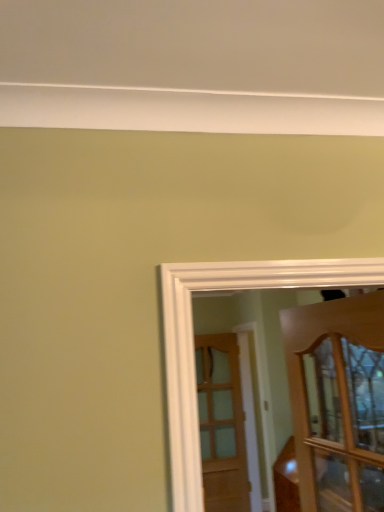
Question: Is point (203, 407) positioned closer to the camera than point (382, 308)?

Choices:
 (A) farther
 (B) closer

Answer: (A)

Question: Is wooden door at center, which appears as the second door when viewed from the top, wider or thinner than wooden cabinet at right, which appears as the 1th door when viewed from the top?

Choices:
 (A) thin
 (B) wide

Answer: (A)

Question: Considering their positions, is wooden door at center, which appears as the second door when viewed from the top, located in front of or behind wooden cabinet at right, which appears as the 1th door when viewed from the top?

Choices:
 (A) front
 (B) behind

Answer: (B)

Question: From a real-world perspective, relative to wooden door at center, which appears as the second door when viewed from the top, is wooden cabinet at right, the 2th door when ordered from bottom to top, vertically above or below?

Choices:
 (A) above
 (B) below

Answer: (A)

Question: Considering their positions, is wooden cabinet at right, placed as the 1th door when sorted from front to back, located in front of or behind wooden door at center, positioned as the 1th door in bottom-to-top order?

Choices:
 (A) behind
 (B) front

Answer: (B)

Question: In terms of height, does wooden cabinet at right, the second door viewed from the back, look taller or shorter compared to wooden door at center, which appears as the second door when viewed from the top?

Choices:
 (A) tall
 (B) short

Answer: (B)

Question: From the image's perspective, relative to wooden door at center, positioned as the first door in back-to-front order, is wooden cabinet at right, the 2th door when ordered from bottom to top, above or below?

Choices:
 (A) below
 (B) above

Answer: (B)